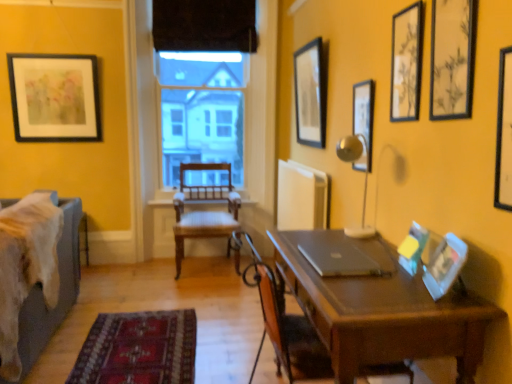
Where is `vacant space positioned to the left of matte plastic picture frame at right, which appears as the fourth picture frame when viewed from the right`? This screenshot has width=512, height=384. vacant space positioned to the left of matte plastic picture frame at right, which appears as the fourth picture frame when viewed from the right is located at coordinates (392, 288).